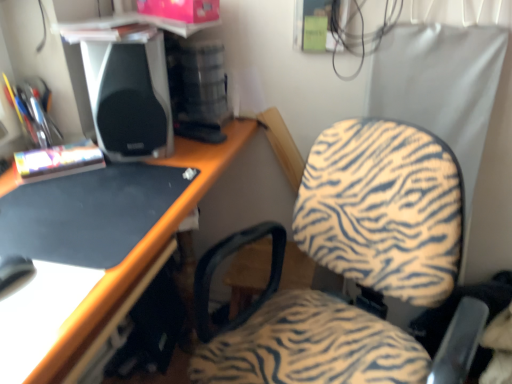
Question: Is zebra-patterned fabric chair at center taller than satin black speaker at upper left?

Choices:
 (A) yes
 (B) no

Answer: (A)

Question: Can you confirm if zebra-patterned fabric chair at center is smaller than satin black speaker at upper left?

Choices:
 (A) no
 (B) yes

Answer: (A)

Question: Considering the relative sizes of zebra-patterned fabric chair at center and satin black speaker at upper left in the image provided, is zebra-patterned fabric chair at center wider than satin black speaker at upper left?

Choices:
 (A) yes
 (B) no

Answer: (A)

Question: Does zebra-patterned fabric chair at center have a lesser height compared to satin black speaker at upper left?

Choices:
 (A) no
 (B) yes

Answer: (A)

Question: Is zebra-patterned fabric chair at center outside satin black speaker at upper left?

Choices:
 (A) yes
 (B) no

Answer: (A)

Question: Is zebra-patterned fabric chair at center positioned with its back to satin black speaker at upper left?

Choices:
 (A) no
 (B) yes

Answer: (A)

Question: Would you say satin black speaker at upper left is outside zebra-patterned fabric chair at center?

Choices:
 (A) yes
 (B) no

Answer: (A)

Question: Is satin black speaker at upper left at the right side of zebra-patterned fabric chair at center?

Choices:
 (A) no
 (B) yes

Answer: (A)

Question: Does satin black speaker at upper left have a lesser width compared to zebra-patterned fabric chair at center?

Choices:
 (A) yes
 (B) no

Answer: (A)

Question: Is satin black speaker at upper left positioned far away from zebra-patterned fabric chair at center?

Choices:
 (A) yes
 (B) no

Answer: (B)

Question: Is satin black speaker at upper left at the left side of zebra-patterned fabric chair at center?

Choices:
 (A) yes
 (B) no

Answer: (A)

Question: From a real-world perspective, is satin black speaker at upper left beneath zebra-patterned fabric chair at center?

Choices:
 (A) yes
 (B) no

Answer: (B)

Question: Would you say zebra-patterned fabric chair at center is to the left or to the right of satin black speaker at upper left in the picture?

Choices:
 (A) right
 (B) left

Answer: (A)